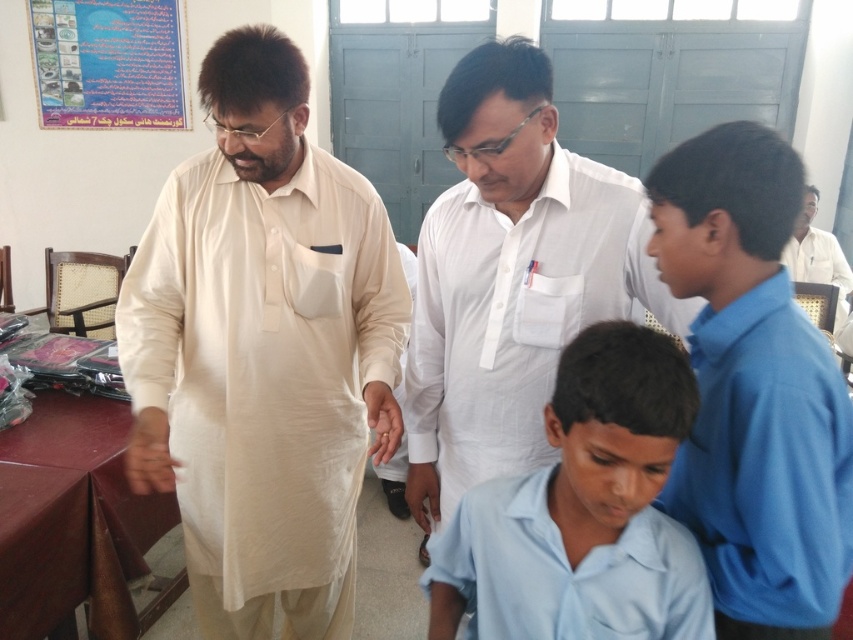
The width and height of the screenshot is (853, 640). What do you see at coordinates (511, 276) in the screenshot? I see `white cotton shirt at center` at bounding box center [511, 276].

Is point (688, 316) closer to viewer compared to point (776, 230)?

No, it is behind (776, 230).

You are a GUI agent. You are given a task and a screenshot of the screen. Output one action in this format:
    pyautogui.click(x=<x>, y=<y>)
    Task: Click on the white cotton shirt at center
    The image size is (853, 640).
    Given the screenshot: What is the action you would take?
    pyautogui.click(x=511, y=276)

Which is in front, point (276, 42) or point (173, 29)?

Positioned in front is point (276, 42).

Can you confirm if beige cotton kurta at center is positioned to the right of blue paperboard at upper left?

Indeed, beige cotton kurta at center is positioned on the right side of blue paperboard at upper left.

Does point (386, 385) come behind point (44, 19)?

No, (386, 385) is closer to viewer.

In order to click on beige cotton kurta at center in this screenshot , I will do `click(263, 349)`.

Which is below, beige cotton kurta at center or light blue cotton shirt at lower center?

Positioned lower is light blue cotton shirt at lower center.

Which of these two, beige cotton kurta at center or light blue cotton shirt at lower center, stands shorter?

With less height is light blue cotton shirt at lower center.

You are a GUI agent. You are given a task and a screenshot of the screen. Output one action in this format:
    pyautogui.click(x=<x>, y=<y>)
    Task: Click on the beige cotton kurta at center
    Image resolution: width=853 pixels, height=640 pixels.
    Given the screenshot: What is the action you would take?
    pyautogui.click(x=263, y=349)

Locate an element on the screen. The width and height of the screenshot is (853, 640). beige cotton kurta at center is located at coordinates (263, 349).